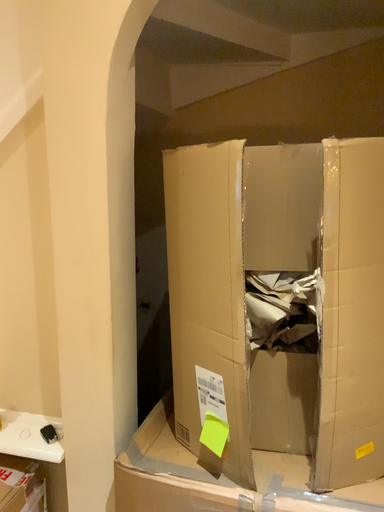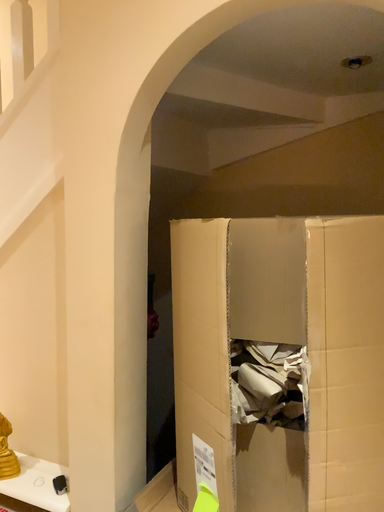
Question: Which way did the camera rotate in the video?

Choices:
 (A) rotated right
 (B) rotated left

Answer: (B)